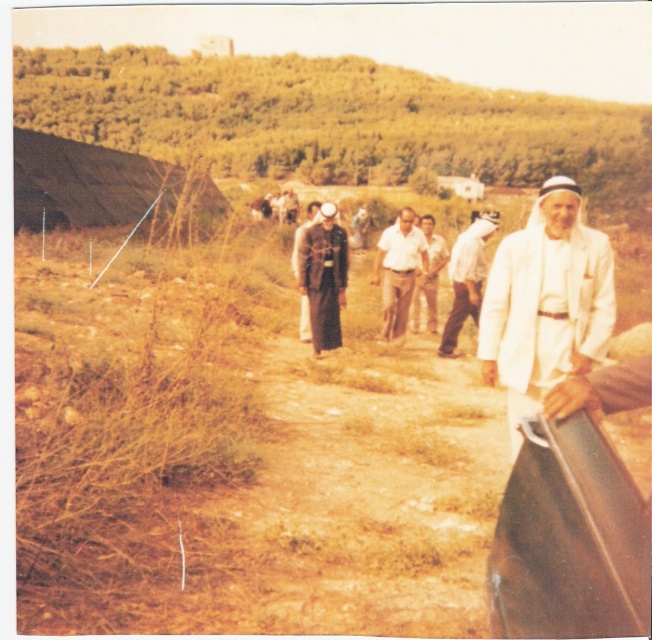
Is brown leather car at center above white matte jacket at right?

No, brown leather car at center is not above white matte jacket at right.

Consider the image. Which is above, brown leather car at center or white matte jacket at right?

white matte jacket at right

Find the location of `brown leather car at center`. brown leather car at center is located at coordinates (569, 538).

This screenshot has width=652, height=640. Find the location of `brown leather car at center`. brown leather car at center is located at coordinates (569, 538).

Does white matte jacket at lower right lie in front of light brown leather jacket at center?

Yes, white matte jacket at lower right is closer to the viewer.

Is white matte jacket at lower right bigger than light brown leather jacket at center?

Indeed, white matte jacket at lower right has a larger size compared to light brown leather jacket at center.

The image size is (652, 640). Describe the element at coordinates (544, 301) in the screenshot. I see `white matte jacket at lower right` at that location.

I want to click on white matte jacket at lower right, so click(544, 301).

Between point (509, 268) and point (310, 317), which one is positioned in front?

Point (509, 268) is in front.

From the picture: Which is below, white matte jacket at lower right or dark gray uniform at center?

white matte jacket at lower right

The image size is (652, 640). I want to click on white matte jacket at lower right, so click(x=544, y=301).